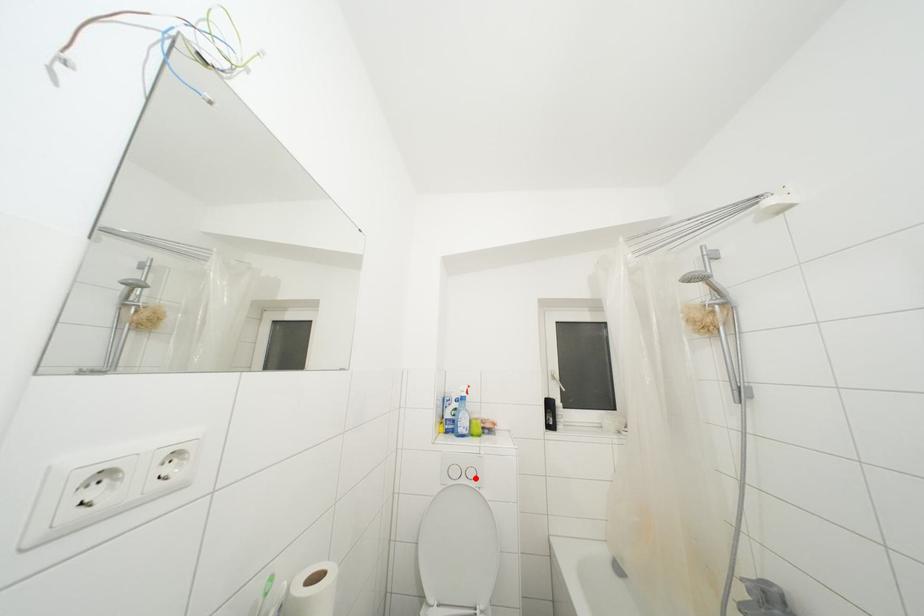
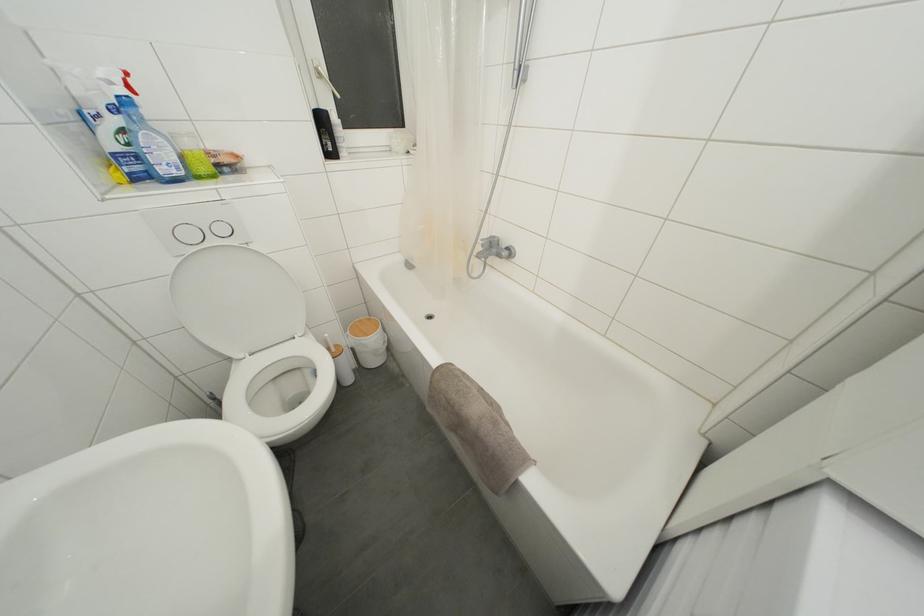
Question: I am providing you with two images of the same scene from different viewpoints. Given a red point in image1, look at the same physical point in image2. Is it:

Choices:
 (A) Closer to the viewpoint
 (B) Farther from the viewpoint

Answer: (A)